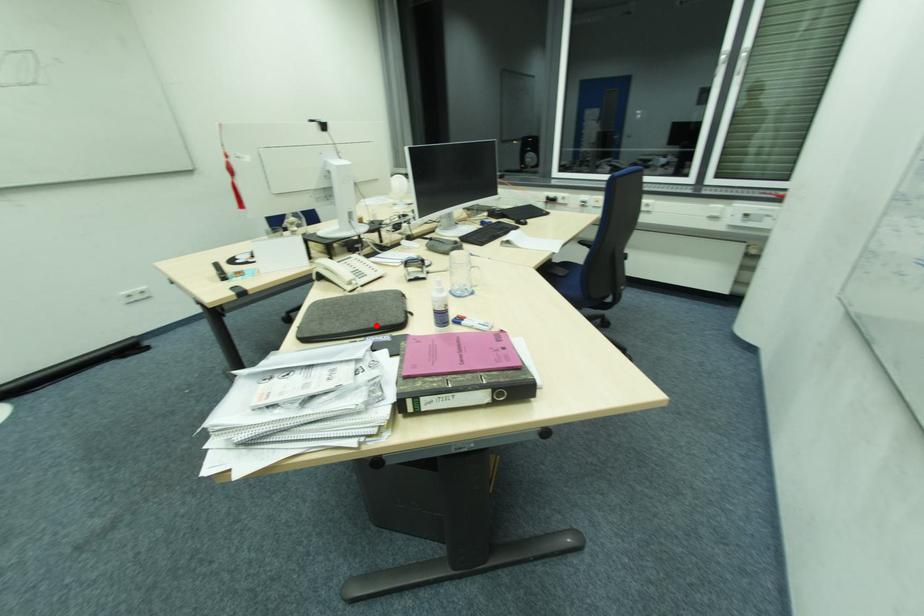
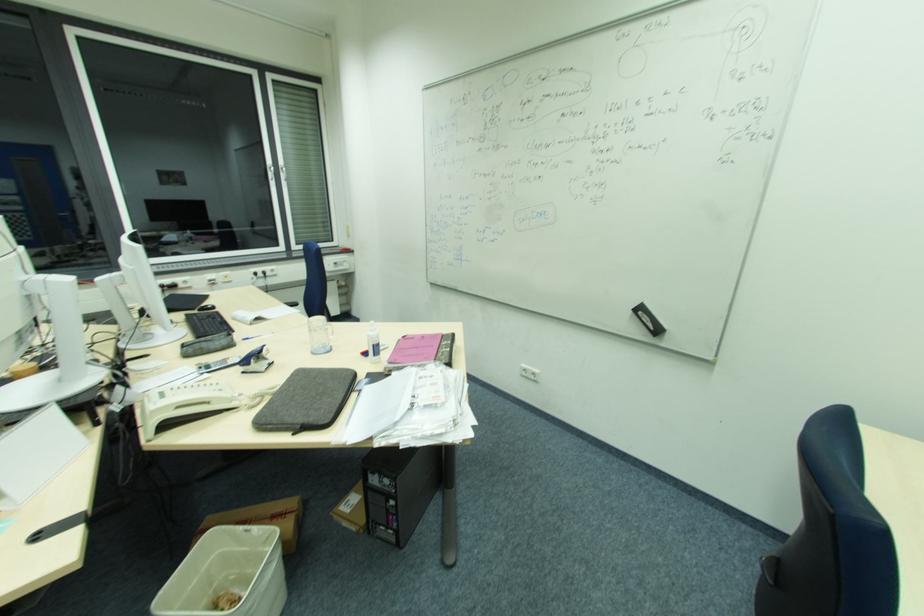
Find the pixel in the second image that matches the highlighted location in the first image.

(350, 382)